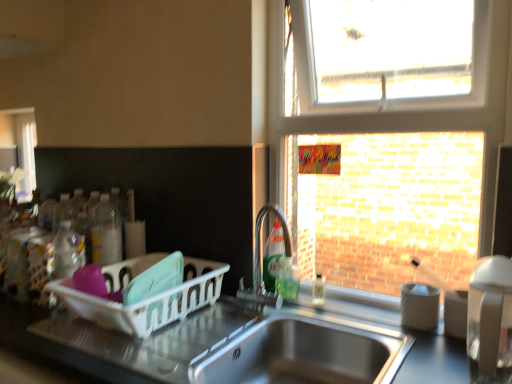
You are a GUI agent. You are given a task and a screenshot of the screen. Output one action in this format:
    pyautogui.click(x=<x>, y=<y>)
    Task: Click on the vacant region to the right of green translucent soap dispenser at sink, positioned as the 2th bottle in right-to-left order
    This screenshot has width=512, height=384.
    Given the screenshot: What is the action you would take?
    pyautogui.click(x=332, y=302)